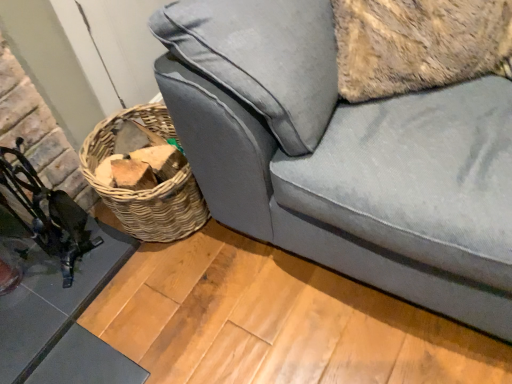
Question: Can we say metallic black swivel chair at left lies outside glassy black table at lower left?

Choices:
 (A) no
 (B) yes

Answer: (B)

Question: From a real-world perspective, does metallic black swivel chair at left stand above glassy black table at lower left?

Choices:
 (A) no
 (B) yes

Answer: (B)

Question: Considering the relative sizes of metallic black swivel chair at left and glassy black table at lower left in the image provided, is metallic black swivel chair at left shorter than glassy black table at lower left?

Choices:
 (A) no
 (B) yes

Answer: (A)

Question: From the image's perspective, is metallic black swivel chair at left located beneath glassy black table at lower left?

Choices:
 (A) no
 (B) yes

Answer: (A)

Question: Can you confirm if metallic black swivel chair at left is thinner than glassy black table at lower left?

Choices:
 (A) no
 (B) yes

Answer: (B)

Question: From the image's perspective, is glassy black table at lower left positioned above or below velvet gray couch at lower right?

Choices:
 (A) below
 (B) above

Answer: (A)

Question: In terms of size, does glassy black table at lower left appear bigger or smaller than velvet gray couch at lower right?

Choices:
 (A) small
 (B) big

Answer: (A)

Question: In the image, is glassy black table at lower left on the left side or the right side of velvet gray couch at lower right?

Choices:
 (A) left
 (B) right

Answer: (A)

Question: From a real-world perspective, is glassy black table at lower left physically located above or below velvet gray couch at lower right?

Choices:
 (A) below
 (B) above

Answer: (A)

Question: Is metallic black swivel chair at left wider or thinner than velvet gray couch at lower right?

Choices:
 (A) thin
 (B) wide

Answer: (A)

Question: From their relative heights in the image, would you say metallic black swivel chair at left is taller or shorter than velvet gray couch at lower right?

Choices:
 (A) short
 (B) tall

Answer: (A)

Question: In terms of size, does metallic black swivel chair at left appear bigger or smaller than velvet gray couch at lower right?

Choices:
 (A) small
 (B) big

Answer: (A)

Question: Is point (67, 261) closer or farther from the camera than point (426, 105)?

Choices:
 (A) farther
 (B) closer

Answer: (A)

Question: From the image's perspective, relative to metallic black swivel chair at left, is glassy black table at lower left above or below?

Choices:
 (A) below
 (B) above

Answer: (A)

Question: Is point (95, 223) positioned closer to the camera than point (64, 254)?

Choices:
 (A) closer
 (B) farther

Answer: (B)